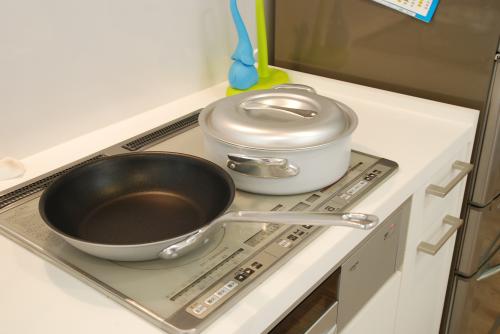
What are the coordinates of `drawer` in the screenshot? It's located at (432, 205).